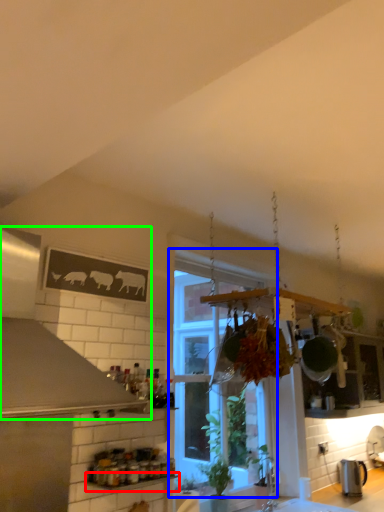
Question: Which object is positioned farthest from window sill (highlighted by a red box)? Select from window (highlighted by a blue box) and exhaust hood (highlighted by a green box).

Choices:
 (A) window
 (B) exhaust hood

Answer: (A)